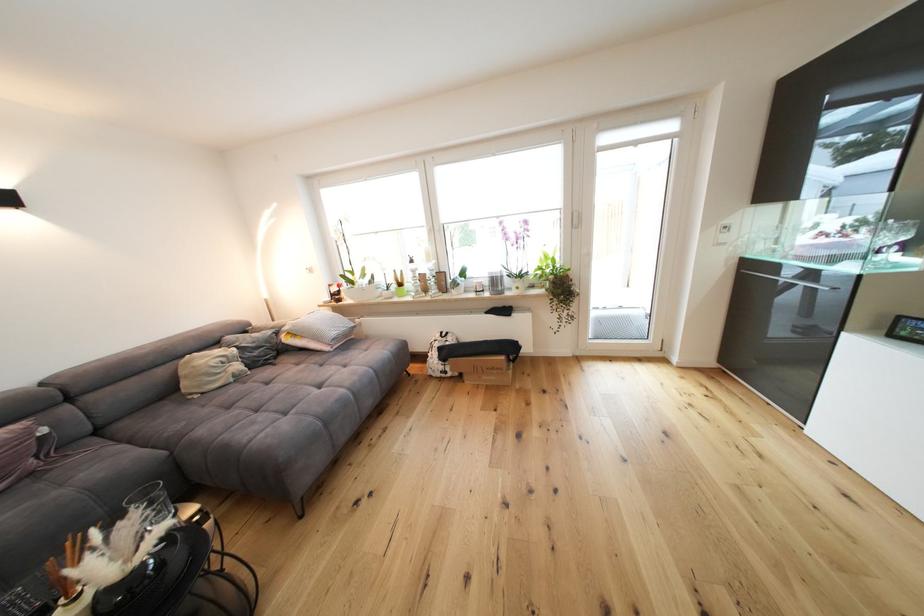
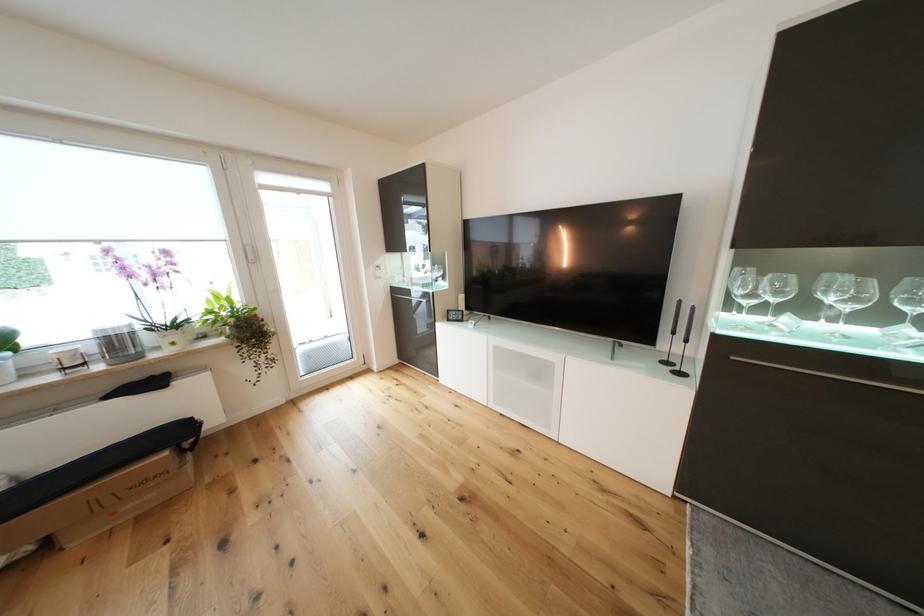
Locate, in the second image, the point that corresponds to (x=517, y=350) in the first image.

(186, 435)